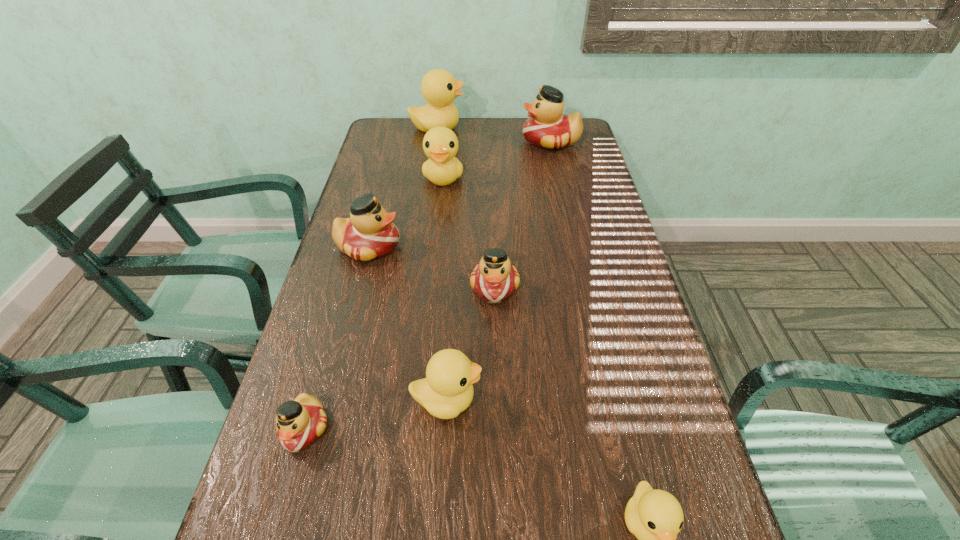
Where is `the closest red duck to the third nearest red duck`? The height and width of the screenshot is (540, 960). the closest red duck to the third nearest red duck is located at coordinates (494, 279).

Where is `red duck that is the fourth closest to the third farthest duck`? red duck that is the fourth closest to the third farthest duck is located at coordinates (299, 422).

Image resolution: width=960 pixels, height=540 pixels. Identify the location of vacant point that satisfies the following two spatial constraints: 1. on the face of the third farthest duck; 2. on the face of the fifth nearest duck. [x=436, y=246].